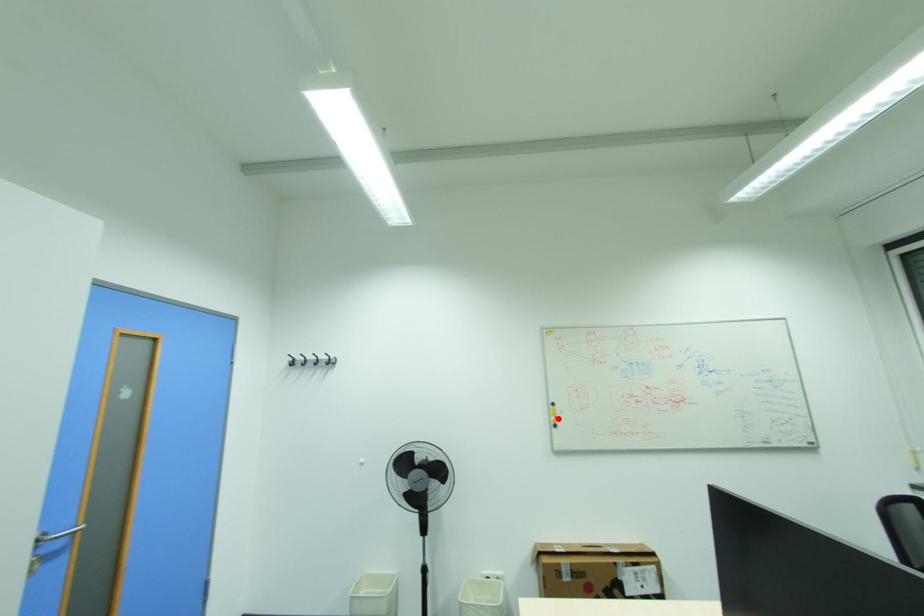
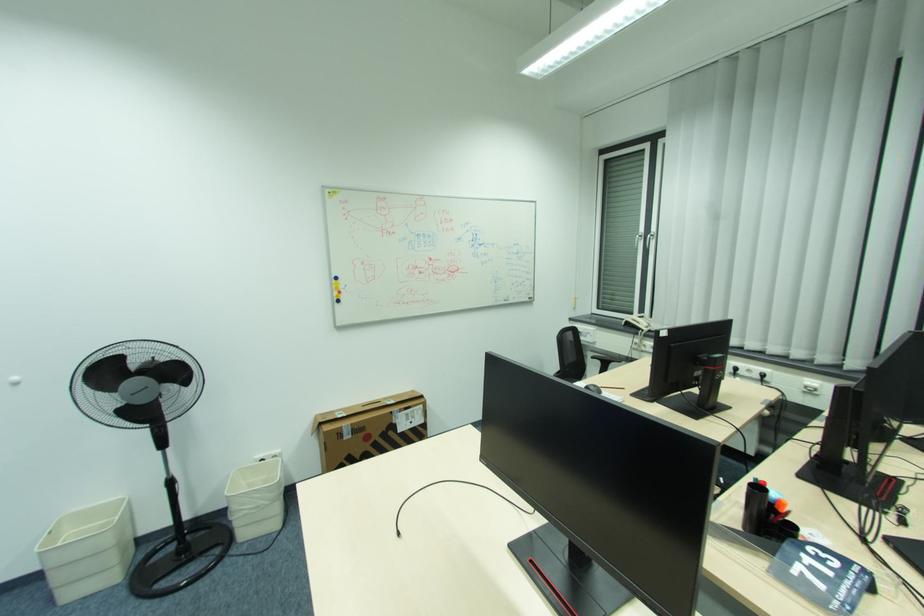
In the second image, find the point that corresponds to the highlighted location in the first image.

(341, 294)